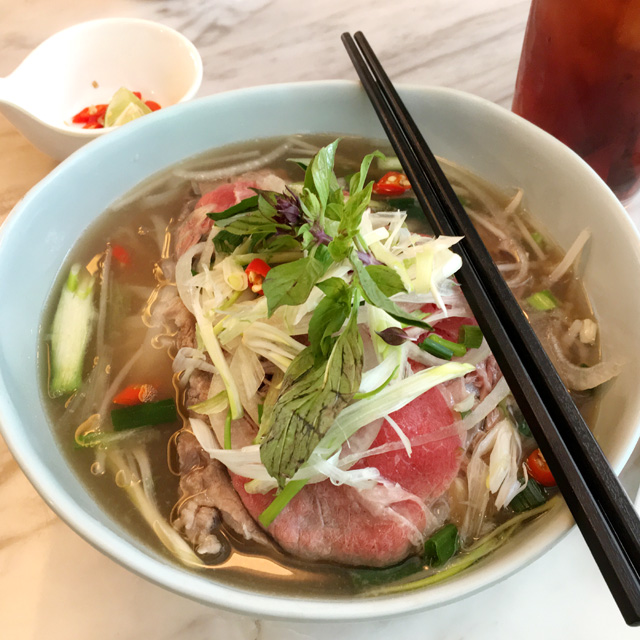
I want to click on left tip of chopsticks, so click(347, 41).